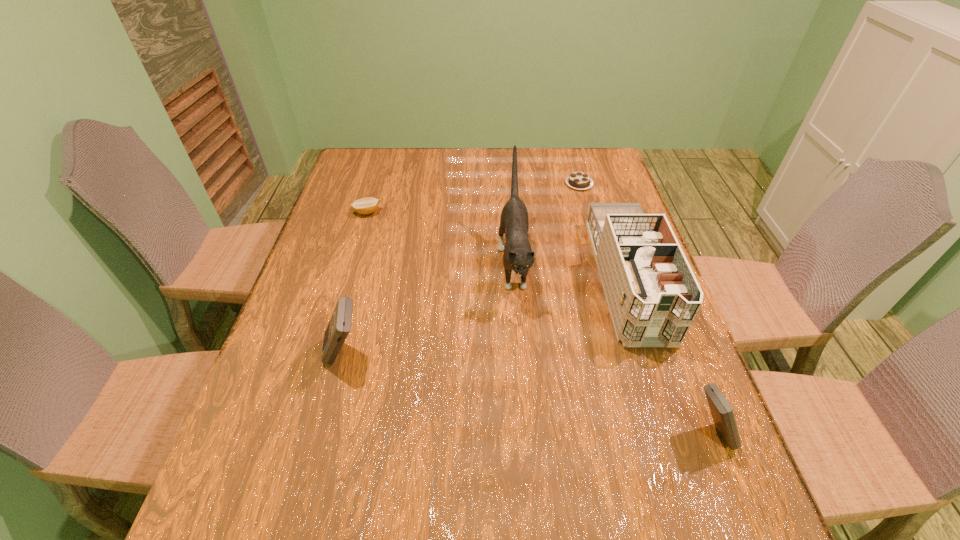
Please point a space for a new calculator to maintain equal intervals. Please provide its 2D coordinates. Your answer should be formatted as a tuple, i.e. [(x, y)], where the tuple contains the x and y coordinates of a point satisfying the conditions above.

[(515, 392)]